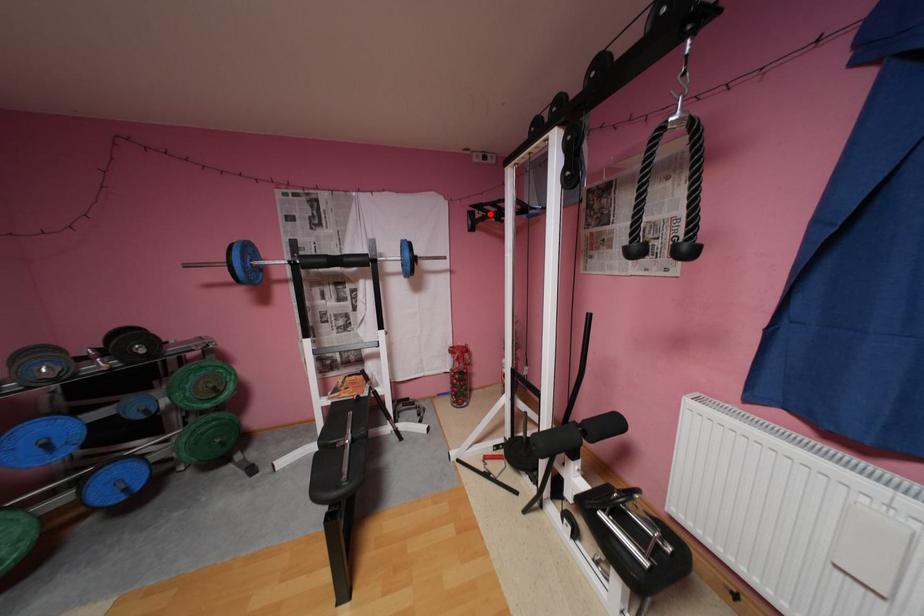
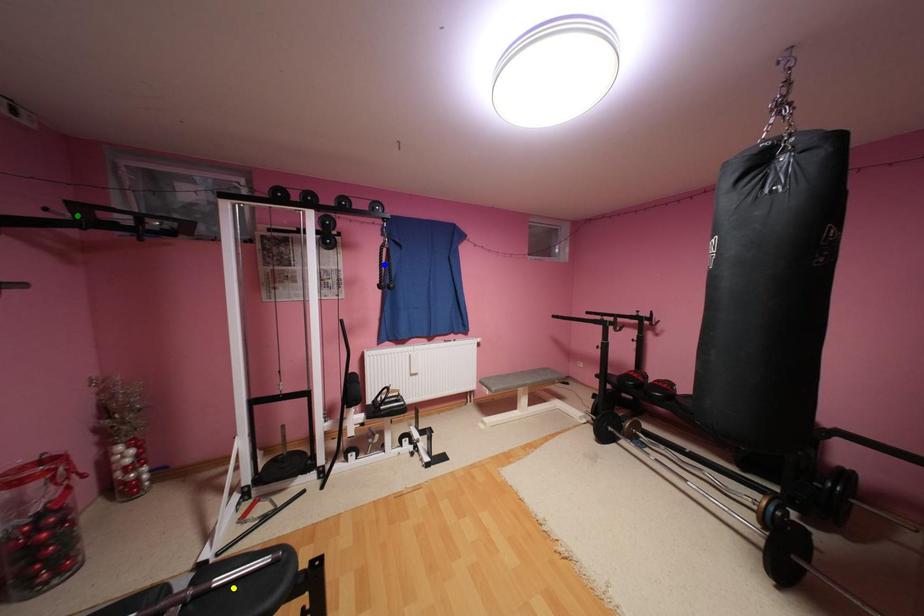
Question: I am providing you with two images of the same scene from different viewpoints. A red point is marked on the first image. You are given multiple points on the second image. Which spot in image 2 lines up with the point in image 1?

Choices:
 (A) yellow point
 (B) blue point
 (C) green point

Answer: (C)